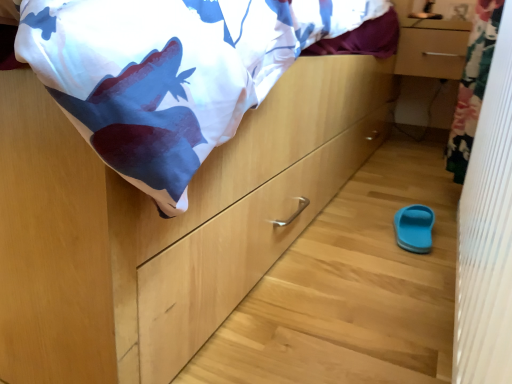
Measure the distance between point (448,63) and camera.

They are 6.13 feet apart.

You are a GUI agent. You are given a task and a screenshot of the screen. Output one action in this format:
    pyautogui.click(x=<x>, y=<y>)
    Task: Click on the white textured curtain at right
    
    Given the screenshot: What is the action you would take?
    pyautogui.click(x=487, y=233)

Where is `blue rubber slipper at lower right`? The height and width of the screenshot is (384, 512). blue rubber slipper at lower right is located at coordinates (414, 228).

Where is `matte wood drawer at upper right`? The image size is (512, 384). matte wood drawer at upper right is located at coordinates (431, 53).

How many degrees apart are the facing directions of matte wood drawer at upper right and blue rubber slipper at lower right?

They differ by 82.7 degrees in their facing directions.

Which of these two, matte wood drawer at upper right or blue rubber slipper at lower right, is smaller?

Smaller between the two is blue rubber slipper at lower right.

Which point is more distant from viewer, [404,45] or [412,207]?

The point [404,45] is behind.

Locate an element on the screen. The width and height of the screenshot is (512, 384). drawer on the right side of blue rubber slipper at lower right is located at coordinates (431, 53).

From the image's perspective, would you say blue rubber slipper at lower right is shown under matte wood drawer at upper right?

Yes.

Can you confirm if blue rubber slipper at lower right is positioned to the left of matte wood drawer at upper right?

Correct, you'll find blue rubber slipper at lower right to the left of matte wood drawer at upper right.

Between blue rubber slipper at lower right and matte wood drawer at upper right, which one has smaller width?

With smaller width is blue rubber slipper at lower right.

Looking at the image, does blue rubber slipper at lower right seem bigger or smaller compared to matte wood drawer at upper right?

Considering their sizes, blue rubber slipper at lower right takes up less space than matte wood drawer at upper right.

Does white textured curtain at right have a smaller size compared to blue rubber slipper at lower right?

Actually, white textured curtain at right might be larger than blue rubber slipper at lower right.

Is point (509, 257) more distant than point (424, 231)?

That is False.

From the image's perspective, would you say white textured curtain at right is shown under blue rubber slipper at lower right?

Incorrect, from the image's perspective, white textured curtain at right is higher than blue rubber slipper at lower right.

From a real-world perspective, is white textured curtain at right over blue rubber slipper at lower right?

Yes, from a real-world perspective, white textured curtain at right is over blue rubber slipper at lower right

Is blue rubber slipper at lower right behind white textured curtain at right?

Yes, blue rubber slipper at lower right is behind white textured curtain at right.

From the image's perspective, is blue rubber slipper at lower right over white textured curtain at right?

No, from the image's perspective, blue rubber slipper at lower right is not on top of white textured curtain at right.

Can you tell me how much blue rubber slipper at lower right and white textured curtain at right differ in facing direction?

blue rubber slipper at lower right and white textured curtain at right are facing 7.31 degrees away from each other.

Are white textured curtain at right and matte wood drawer at upper right making contact?

No.

Is matte wood drawer at upper right completely or partially inside white textured curtain at right?

No.

Does white textured curtain at right have a lesser height compared to matte wood drawer at upper right?

No, white textured curtain at right is not shorter than matte wood drawer at upper right.

Considering the points (495, 50) and (455, 52), which point is in front, point (495, 50) or point (455, 52)?

The point (495, 50) is in front.

Can you tell me how much matte wood drawer at upper right and white textured curtain at right differ in facing direction?

matte wood drawer at upper right and white textured curtain at right are facing 90 degrees away from each other.

From a real-world perspective, which is physically above, matte wood drawer at upper right or white textured curtain at right?

matte wood drawer at upper right, from a real-world perspective.

From the image's perspective, which is above, matte wood drawer at upper right or white textured curtain at right?

From the image's view, matte wood drawer at upper right is above.

Looking at this image, which is correct: matte wood drawer at upper right is inside white textured curtain at right, or outside of it?

matte wood drawer at upper right is outside white textured curtain at right.

Image resolution: width=512 pixels, height=384 pixels. In order to click on footwear in front of the matte wood drawer at upper right in this screenshot , I will do `click(414, 228)`.

You are a GUI agent. You are given a task and a screenshot of the screen. Output one action in this format:
    pyautogui.click(x=<x>, y=<y>)
    Task: Click on the drawer located on the right of blue rubber slipper at lower right
    
    Given the screenshot: What is the action you would take?
    pyautogui.click(x=431, y=53)

Looking at the image, which one is located further to blue rubber slipper at lower right, matte wood drawer at upper right or white textured curtain at right?

matte wood drawer at upper right lies further to blue rubber slipper at lower right than the other object.

When comparing their distances from blue rubber slipper at lower right, does white textured curtain at right or matte wood drawer at upper right seem further?

matte wood drawer at upper right is positioned further to the anchor blue rubber slipper at lower right.

From the image, which object appears to be nearer to white textured curtain at right, blue rubber slipper at lower right or matte wood drawer at upper right?

blue rubber slipper at lower right is closer to white textured curtain at right.

Estimate the real-world distances between objects in this image. Which object is further from matte wood drawer at upper right, blue rubber slipper at lower right or white textured curtain at right?

Based on the image, white textured curtain at right appears to be further to matte wood drawer at upper right.

When comparing their distances from white textured curtain at right, does matte wood drawer at upper right or blue rubber slipper at lower right seem further?

Among the two, matte wood drawer at upper right is located further to white textured curtain at right.

Considering their positions, is white textured curtain at right positioned further to matte wood drawer at upper right than blue rubber slipper at lower right?

white textured curtain at right is positioned further to the anchor matte wood drawer at upper right.

At what (x,y) coordinates should I click in order to perform the action: click on footwear positioned between white textured curtain at right and matte wood drawer at upper right from near to far. Please return your answer as a coordinate pair (x, y). The height and width of the screenshot is (384, 512). Looking at the image, I should click on (414, 228).